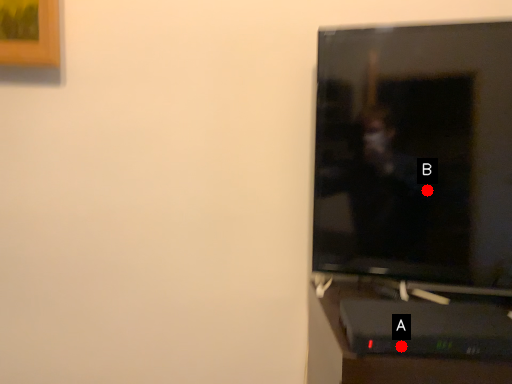
Question: Two points are circled on the image, labeled by A and B beside each circle. Which point appears farthest from the camera in this image?

Choices:
 (A) A is further
 (B) B is further

Answer: (B)